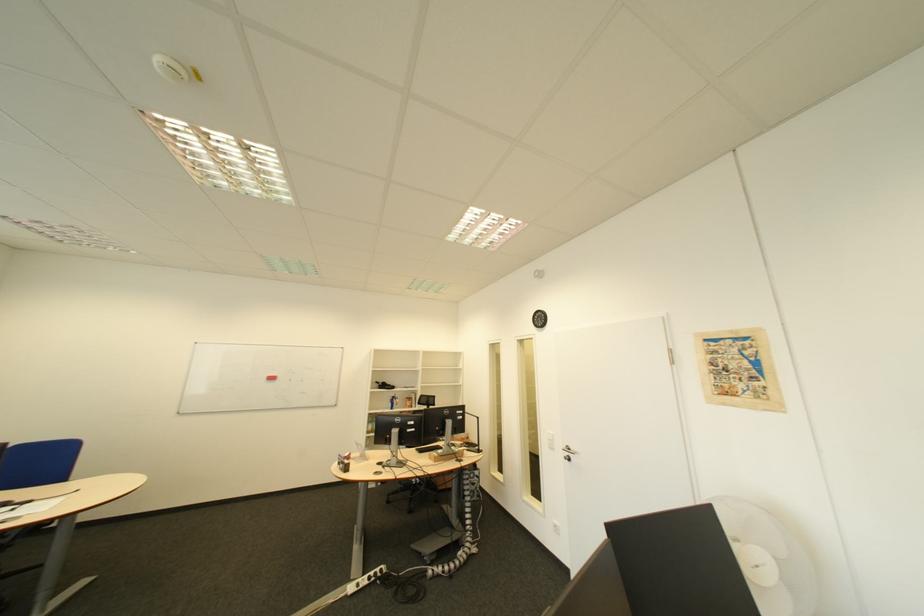
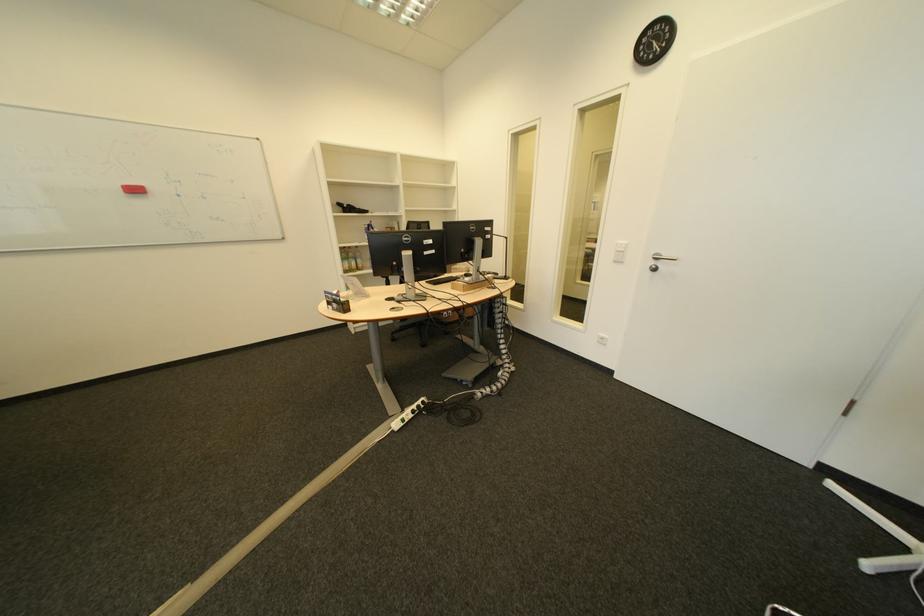
The point at [391,386] is marked in the first image. Where is the corresponding point in the second image?

(354, 209)